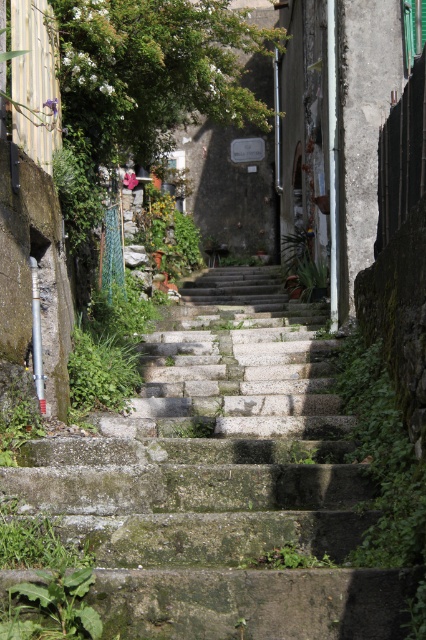
Question: Does green mossy stone stairs at center have a greater width compared to green leafy weed at lower left?

Choices:
 (A) yes
 (B) no

Answer: (A)

Question: Can you confirm if green mossy stone stairs at center is positioned below green leafy weed at lower left?

Choices:
 (A) yes
 (B) no

Answer: (B)

Question: Which point is farther to the camera?

Choices:
 (A) green leafy weed at lower left
 (B) green mossy stone stairs at center

Answer: (B)

Question: Does green mossy stone stairs at center appear on the right side of green leafy weed at lower left?

Choices:
 (A) no
 (B) yes

Answer: (B)